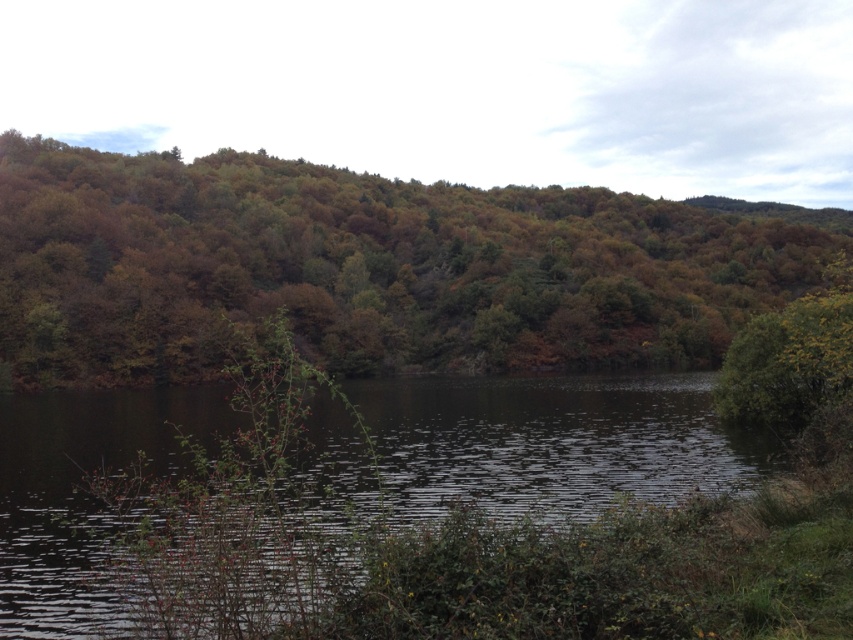
Between green matte tree at center and dark reflective water at center, which one is positioned lower?

dark reflective water at center is lower down.

Is point (126, 212) behind point (593, 413)?

Yes, point (126, 212) is farther from viewer.

Find the location of `green matte tree at center`. green matte tree at center is located at coordinates (372, 268).